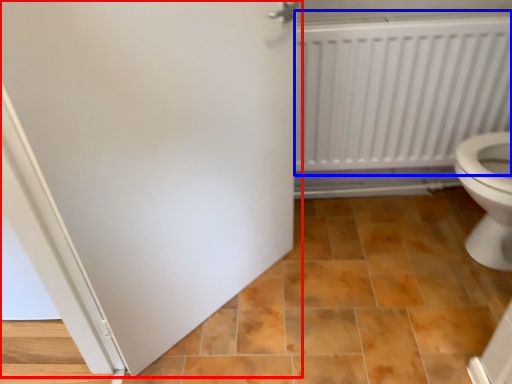
Question: Which of the following is the farthest to the observer, door (highlighted by a red box) or radiator (highlighted by a blue box)?

Choices:
 (A) door
 (B) radiator

Answer: (B)